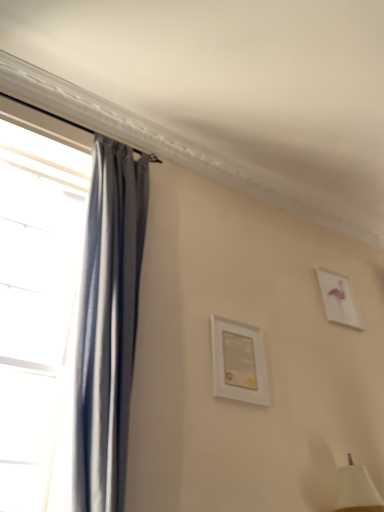
Question: Is white glossy picture frame at upper right, which ranks as the 2th picture frame in left-to-right order, wider than white matte picture frame at center, the 2th picture frame when ordered from right to left?

Choices:
 (A) no
 (B) yes

Answer: (A)

Question: Is white glossy picture frame at upper right, which ranks as the 1th picture frame in back-to-front order, in contact with white matte picture frame at center, which is the 2th picture frame in back-to-front order?

Choices:
 (A) yes
 (B) no

Answer: (B)

Question: Considering the relative sizes of white glossy picture frame at upper right, which ranks as the 2th picture frame in left-to-right order, and white matte picture frame at center, which is the 2th picture frame in back-to-front order, in the image provided, is white glossy picture frame at upper right, which ranks as the 2th picture frame in left-to-right order, bigger than white matte picture frame at center, which is the 2th picture frame in back-to-front order,?

Choices:
 (A) yes
 (B) no

Answer: (A)

Question: Does white glossy picture frame at upper right, marked as the first picture frame in a right-to-left arrangement, turn towards white matte picture frame at center, the first picture frame viewed from the left?

Choices:
 (A) no
 (B) yes

Answer: (A)

Question: Can you confirm if white glossy picture frame at upper right, marked as the first picture frame in a right-to-left arrangement, is smaller than white matte picture frame at center, the first picture frame viewed from the left?

Choices:
 (A) no
 (B) yes

Answer: (A)

Question: In terms of size, does white glossy picture frame at upper right, which ranks as the 1th picture frame in back-to-front order, appear bigger or smaller than matte gray curtain at left?

Choices:
 (A) small
 (B) big

Answer: (A)

Question: From the image's perspective, is white glossy picture frame at upper right, which ranks as the 2th picture frame in left-to-right order, located above or below matte gray curtain at left?

Choices:
 (A) below
 (B) above

Answer: (A)

Question: From a real-world perspective, relative to matte gray curtain at left, is white glossy picture frame at upper right, the second picture frame in the front-to-back sequence, vertically above or below?

Choices:
 (A) above
 (B) below

Answer: (A)

Question: Looking at their shapes, would you say white glossy picture frame at upper right, which ranks as the 1th picture frame in back-to-front order, is wider or thinner than matte gray curtain at left?

Choices:
 (A) wide
 (B) thin

Answer: (B)

Question: In the image, is matte gray curtain at left on the left side or the right side of white matte picture frame at center, marked as the first picture frame in a front-to-back arrangement?

Choices:
 (A) left
 (B) right

Answer: (A)

Question: Is matte gray curtain at left wider or thinner than white matte picture frame at center, the 2th picture frame when ordered from right to left?

Choices:
 (A) wide
 (B) thin

Answer: (A)

Question: Relative to white matte picture frame at center, the first picture frame viewed from the left, is matte gray curtain at left in front or behind?

Choices:
 (A) front
 (B) behind

Answer: (A)

Question: Based on their sizes in the image, would you say matte gray curtain at left is bigger or smaller than white matte picture frame at center, the first picture frame viewed from the left?

Choices:
 (A) small
 (B) big

Answer: (B)

Question: In the image, is white glossy picture frame at upper right, the second picture frame in the front-to-back sequence, on the left side or the right side of white matte picture frame at center, marked as the first picture frame in a front-to-back arrangement?

Choices:
 (A) left
 (B) right

Answer: (B)

Question: Based on their sizes in the image, would you say white glossy picture frame at upper right, the second picture frame in the front-to-back sequence, is bigger or smaller than white matte picture frame at center, the 2th picture frame when ordered from right to left?

Choices:
 (A) big
 (B) small

Answer: (A)